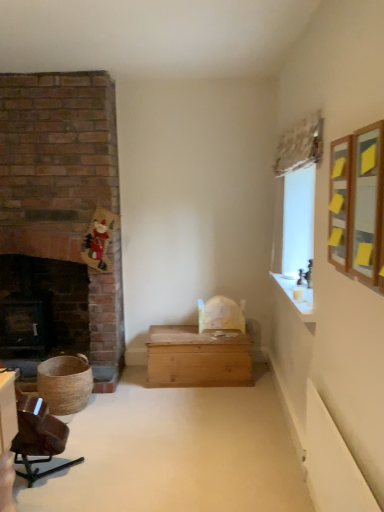
Question: Looking at their shapes, would you say white glossy mantle at upper right is wider or thinner than wooden chest at center?

Choices:
 (A) thin
 (B) wide

Answer: (A)

Question: Would you say white glossy mantle at upper right is to the left or to the right of wooden chest at center in the picture?

Choices:
 (A) right
 (B) left

Answer: (A)

Question: Which object is positioned closest to the black cast iron fireplace at left?

Choices:
 (A) shiny brown leather chair at lower left
 (B) wooden chest at center
 (C) white glossy mantle at upper right
 (D) wooden framed mirror at upper right

Answer: (B)

Question: Which object is positioned farthest from the black cast iron fireplace at left?

Choices:
 (A) shiny brown leather chair at lower left
 (B) wooden framed mirror at upper right
 (C) white glossy mantle at upper right
 (D) wooden chest at center

Answer: (B)